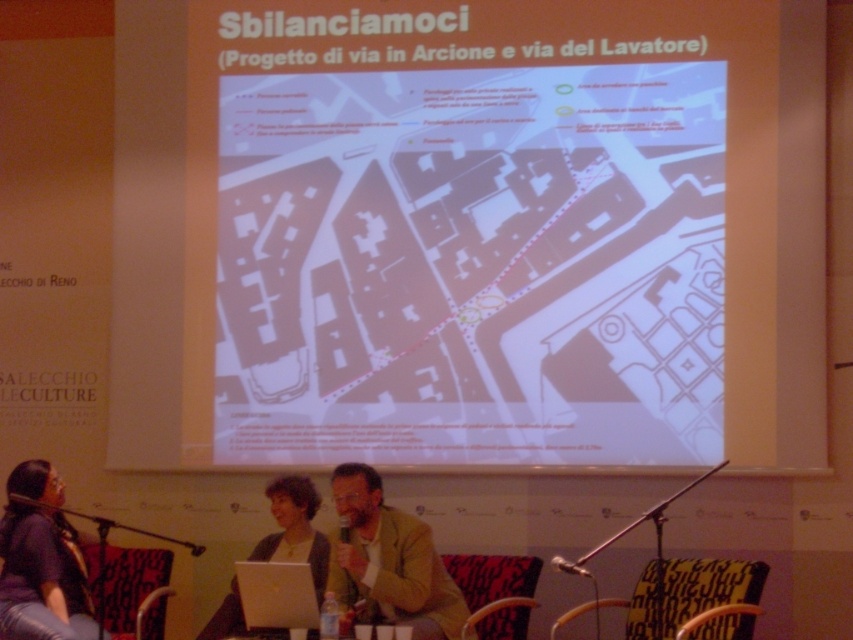
Question: Which is farther from the yellow fabric chair at lower center?

Choices:
 (A) red fabric chair at lower center
 (B) metallic silver microphone at lower center
 (C) light brown leather jacket at center
 (D) black plastic microphone at lower center

Answer: (D)

Question: Which point is closer to the camera?

Choices:
 (A) pyautogui.click(x=82, y=621)
 (B) pyautogui.click(x=263, y=637)
 (C) pyautogui.click(x=163, y=604)

Answer: (B)

Question: Is blue fabric chair at lower left closer to the viewer compared to red fabric chair at lower center?

Choices:
 (A) no
 (B) yes

Answer: (A)

Question: Among these objects, which one is nearest to the camera?

Choices:
 (A) red fabric chair at lower center
 (B) dark blue shirt at lower left

Answer: (B)

Question: Is blue fabric chair at lower left smaller than red fabric chair at lower center?

Choices:
 (A) yes
 (B) no

Answer: (B)

Question: Can you confirm if light brown leather jacket at center is wider than red fabric chair at lower center?

Choices:
 (A) yes
 (B) no

Answer: (A)